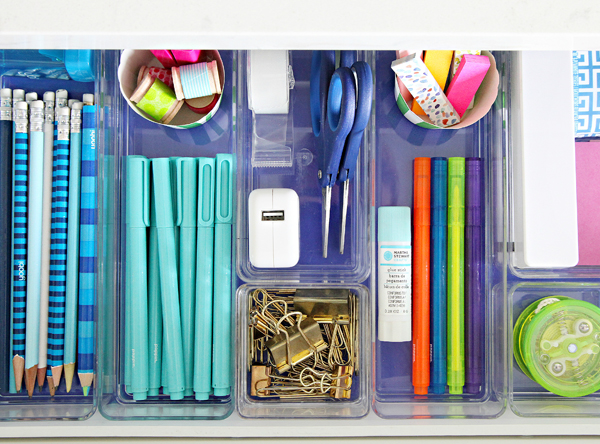
The width and height of the screenshot is (600, 444). What are the coordinates of `binder clips` in the screenshot? It's located at (336, 300), (291, 336), (261, 378), (343, 380).